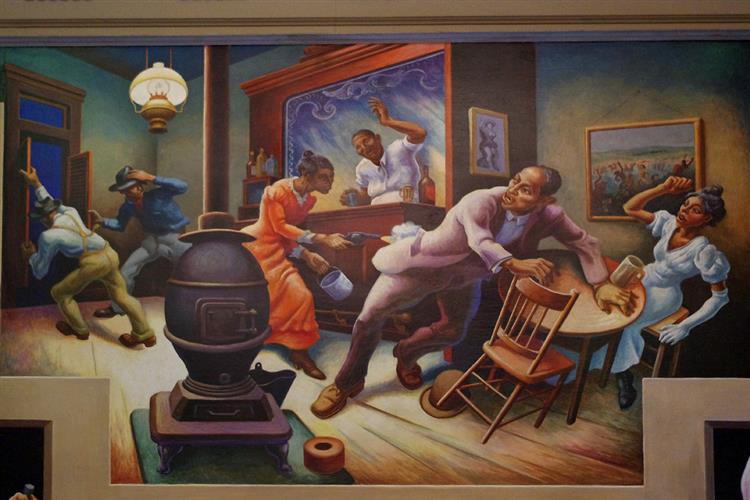
The width and height of the screenshot is (750, 500). Identify the location of chair. (532, 378).